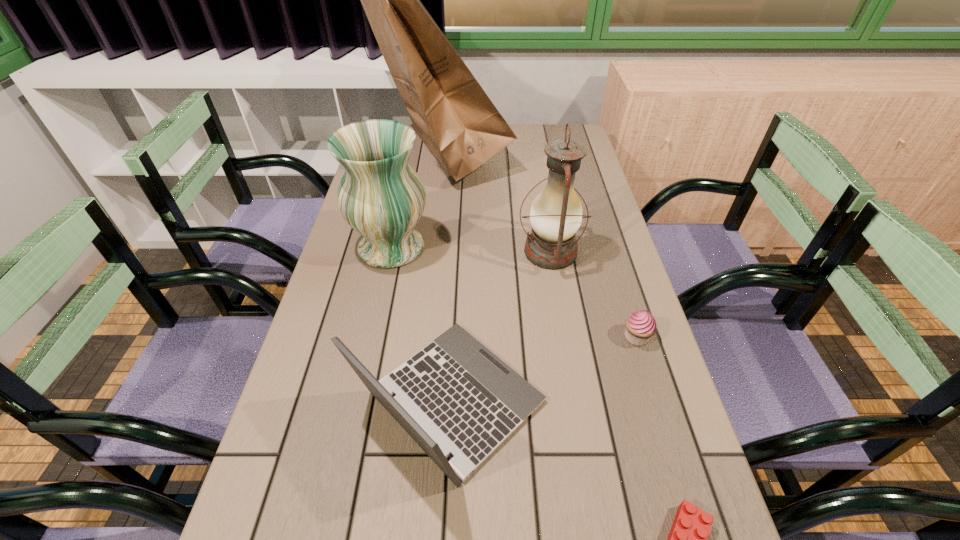
In the image, there is a desktop. Where is `vacant area at the right edge`? vacant area at the right edge is located at coordinates (647, 517).

Image resolution: width=960 pixels, height=540 pixels. In order to click on vacant space that's between the farthest object and the fourth tallest object in this screenshot , I will do `click(446, 278)`.

Find the location of a particular element. vacant space that is in between the tallest object and the oil lamp is located at coordinates (496, 203).

Where is `free space between the oil lamp and the vase`? This screenshot has height=540, width=960. free space between the oil lamp and the vase is located at coordinates (470, 249).

The width and height of the screenshot is (960, 540). I want to click on free spot between the tallest object and the third shortest object, so click(x=446, y=278).

This screenshot has width=960, height=540. I want to click on free space that is in between the vase and the cupcake, so click(x=514, y=292).

Identify which object is the second closest to the vase. Please provide its 2D coordinates. Your answer should be formatted as a tuple, i.e. [(x, y)], where the tuple contains the x and y coordinates of a point satisfying the conditions above.

[(455, 396)]

Choose which object is the nearest neighbor to the vase. Please provide its 2D coordinates. Your answer should be formatted as a tuple, i.e. [(x, y)], where the tuple contains the x and y coordinates of a point satisfying the conditions above.

[(451, 113)]

Identify the location of free location that satisfies the following two spatial constraints: 1. on the front side of the farthest object; 2. on the left side of the cupcake. The height and width of the screenshot is (540, 960). [x=422, y=337].

Identify the location of free space that satisfies the following two spatial constraints: 1. on the front side of the oil lamp; 2. on the left side of the grocery bag. This screenshot has width=960, height=540. (432, 252).